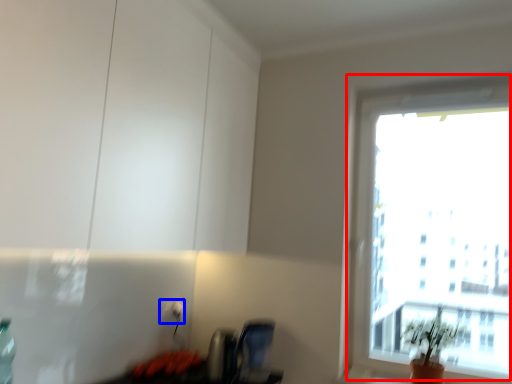
Question: Which point is further to the camera, window (highlighted by a red box) or electric outlet (highlighted by a blue box)?

Choices:
 (A) window
 (B) electric outlet

Answer: (B)